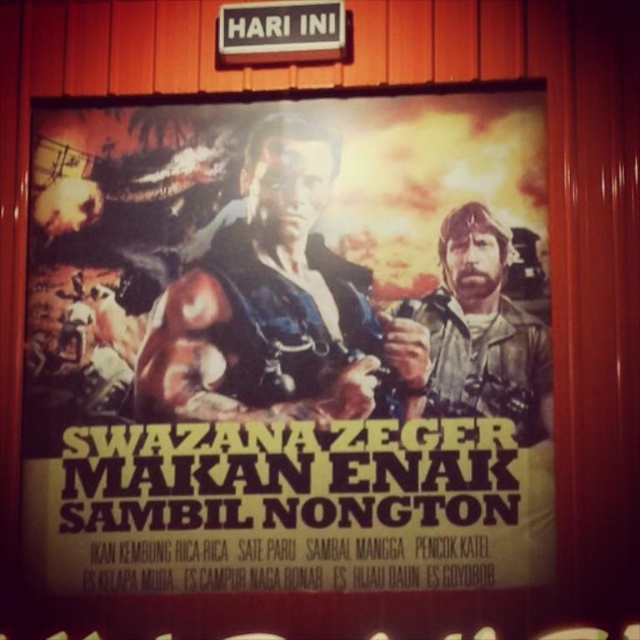
Question: Is matte paper poster at center above metallic sign at upper center?

Choices:
 (A) yes
 (B) no

Answer: (B)

Question: Which object is farther from the camera taking this photo?

Choices:
 (A) metallic sign at upper center
 (B) matte paper poster at center

Answer: (A)

Question: Is matte paper poster at center bigger than metallic sign at upper center?

Choices:
 (A) yes
 (B) no

Answer: (A)

Question: Among these objects, which one is farthest from the camera?

Choices:
 (A) matte paper poster at center
 (B) metallic sign at upper center

Answer: (B)

Question: Which of the following is the farthest from the observer?

Choices:
 (A) (266, 22)
 (B) (108, 236)

Answer: (B)

Question: Is matte paper poster at center to the right of metallic sign at upper center from the viewer's perspective?

Choices:
 (A) no
 (B) yes

Answer: (A)